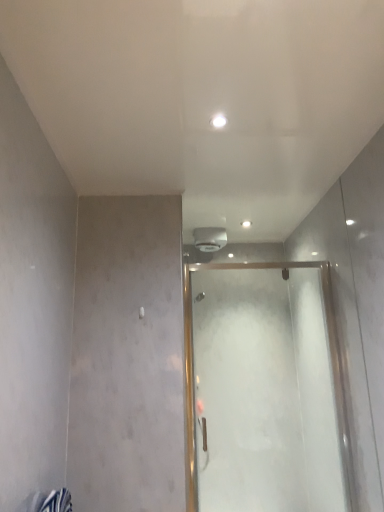
Question: Looking at their shapes, would you say white glossy light at center is wider or thinner than frosted glass door at center?

Choices:
 (A) wide
 (B) thin

Answer: (A)

Question: Is point (215, 121) closer or farther from the camera than point (249, 352)?

Choices:
 (A) closer
 (B) farther

Answer: (A)

Question: Considering the positions of white glossy light at center and frosted glass door at center in the image, is white glossy light at center bigger or smaller than frosted glass door at center?

Choices:
 (A) small
 (B) big

Answer: (A)

Question: In terms of height, does frosted glass door at center look taller or shorter compared to white glossy light at center?

Choices:
 (A) short
 (B) tall

Answer: (B)

Question: Considering the positions of point (309, 437) and point (225, 122), is point (309, 437) closer or farther from the camera than point (225, 122)?

Choices:
 (A) farther
 (B) closer

Answer: (A)

Question: From a real-world perspective, is frosted glass door at center above or below white glossy light at center?

Choices:
 (A) below
 (B) above

Answer: (A)

Question: In terms of size, does frosted glass door at center appear bigger or smaller than white glossy light at center?

Choices:
 (A) big
 (B) small

Answer: (A)